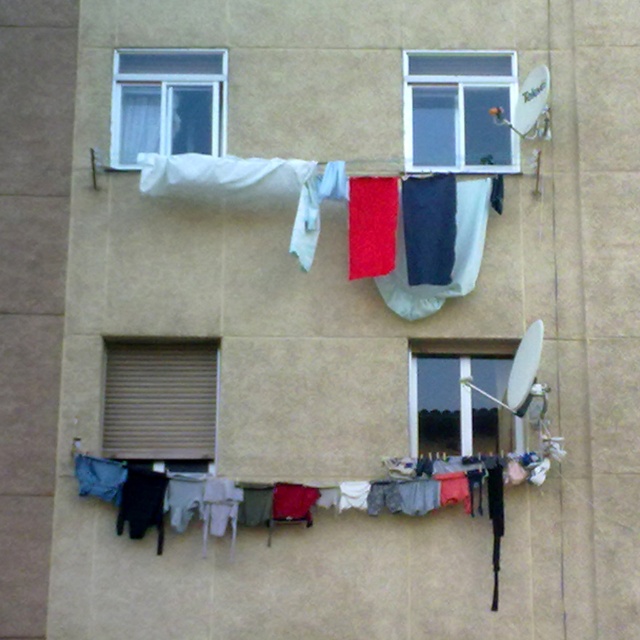
Question: Which object appears farthest from the camera in this image?

Choices:
 (A) transparent glass window at center
 (B) brown matte shutter at lower left
 (C) white fabric at upper left

Answer: (C)

Question: Can you confirm if clear glass window at upper center is thinner than transparent glass window at center?

Choices:
 (A) yes
 (B) no

Answer: (B)

Question: Can you confirm if clear glass window at upper center is bigger than transparent glass window at center?

Choices:
 (A) no
 (B) yes

Answer: (B)

Question: Which of the following is the closest to the observer?

Choices:
 (A) white fabric at upper left
 (B) textured fabric clothesline at lower center
 (C) transparent glass window at center

Answer: (B)

Question: Is textured fabric clothesline at lower center smaller than brown matte shutter at lower left?

Choices:
 (A) no
 (B) yes

Answer: (A)

Question: Which object is farther from the camera taking this photo?

Choices:
 (A) white fabric at upper left
 (B) clear glass window at upper center
 (C) transparent glass window at center
 (D) textured fabric clothesline at lower center

Answer: (B)